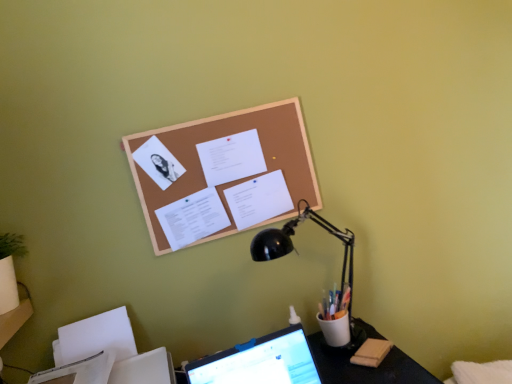
Question: Is white paper at center, positioned as the second document in bottom-to-top order, smaller than corkboard at upper center?

Choices:
 (A) no
 (B) yes

Answer: (B)

Question: Is white paper at center, marked as the 2th document in a top-to-bottom arrangement, thinner than corkboard at upper center?

Choices:
 (A) yes
 (B) no

Answer: (B)

Question: Does white paper at center, marked as the 2th document in a top-to-bottom arrangement, come in front of corkboard at upper center?

Choices:
 (A) yes
 (B) no

Answer: (B)

Question: Is white paper at center, positioned as the second document in bottom-to-top order, far from corkboard at upper center?

Choices:
 (A) yes
 (B) no

Answer: (B)

Question: Is white paper at center, positioned as the second document in bottom-to-top order, outside corkboard at upper center?

Choices:
 (A) yes
 (B) no

Answer: (B)

Question: Visually, is black plastic desk at lower center positioned to the left or to the right of white paper at center, arranged as the 1th document when viewed from the top?

Choices:
 (A) left
 (B) right

Answer: (B)

Question: From the image's perspective, relative to white paper at center, arranged as the 1th document when viewed from the top, is black plastic desk at lower center above or below?

Choices:
 (A) below
 (B) above

Answer: (A)

Question: Is black plastic desk at lower center taller or shorter than white paper at center, arranged as the 1th document when viewed from the top?

Choices:
 (A) short
 (B) tall

Answer: (B)

Question: Looking at their shapes, would you say black plastic desk at lower center is wider or thinner than white paper at center, arranged as the 1th document when viewed from the top?

Choices:
 (A) wide
 (B) thin

Answer: (A)

Question: In terms of width, does black metal lamp at upper right look wider or thinner when compared to white paper at center, which ranks as the third document in top-to-bottom order?

Choices:
 (A) thin
 (B) wide

Answer: (B)

Question: From the image's perspective, is black metal lamp at upper right above or below white paper at center, the 1th document when ordered from bottom to top?

Choices:
 (A) below
 (B) above

Answer: (A)

Question: From a real-world perspective, relative to white paper at center, the 1th document when ordered from bottom to top, is black metal lamp at upper right vertically above or below?

Choices:
 (A) below
 (B) above

Answer: (A)

Question: Considering their positions, is black metal lamp at upper right located in front of or behind white paper at center, the 1th document when ordered from bottom to top?

Choices:
 (A) front
 (B) behind

Answer: (A)

Question: In terms of size, does white paper at center, positioned as the second document in bottom-to-top order, appear bigger or smaller than white paper at center, arranged as the 1th document when viewed from the top?

Choices:
 (A) small
 (B) big

Answer: (B)

Question: Is point (265, 205) positioned closer to the camera than point (218, 152)?

Choices:
 (A) closer
 (B) farther

Answer: (B)